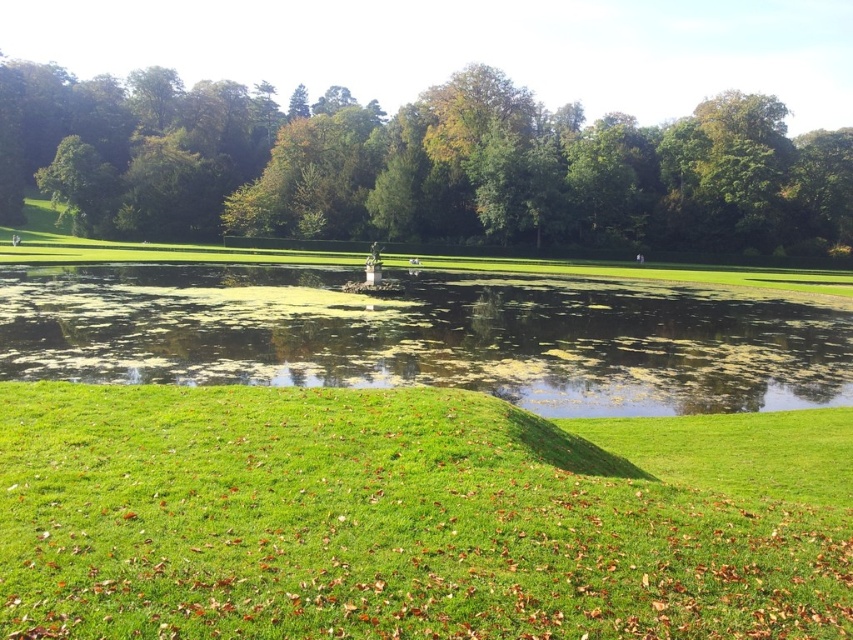
Question: Which point appears farthest from the camera in this image?

Choices:
 (A) (268, 588)
 (B) (770, 355)
 (C) (50, 150)

Answer: (C)

Question: Which point is farther to the camera?

Choices:
 (A) green algae-covered water at center
 (B) green leafy tree at center

Answer: (B)

Question: Does green grass at lower center appear under green algae-covered water at center?

Choices:
 (A) yes
 (B) no

Answer: (A)

Question: Considering the real-world distances, which object is closest to the green algae-covered water at center?

Choices:
 (A) green leafy tree at center
 (B) green grass at lower center

Answer: (B)

Question: Can you confirm if green grass at lower center is smaller than green algae-covered water at center?

Choices:
 (A) yes
 (B) no

Answer: (A)

Question: Observing the image, what is the correct spatial positioning of green grass at lower center in reference to green algae-covered water at center?

Choices:
 (A) right
 (B) left

Answer: (A)